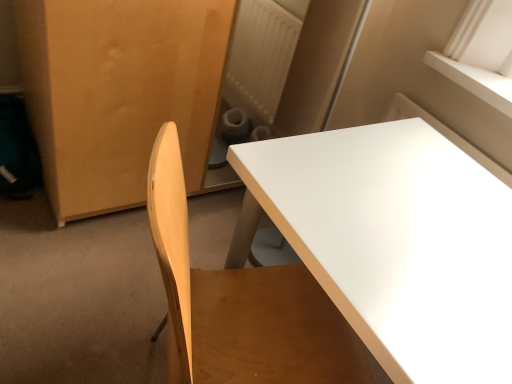
Question: Is matte wood armoire at left in front of or behind white glossy table at center in the image?

Choices:
 (A) front
 (B) behind

Answer: (B)

Question: Based on their sizes in the image, would you say matte wood armoire at left is bigger or smaller than white glossy table at center?

Choices:
 (A) big
 (B) small

Answer: (A)

Question: In the image, is matte wood armoire at left on the left side or the right side of white glossy table at center?

Choices:
 (A) left
 (B) right

Answer: (A)

Question: From the image's perspective, is white glossy table at center located above or below matte wood armoire at left?

Choices:
 (A) above
 (B) below

Answer: (B)

Question: In the image, is white glossy table at center positioned in front of or behind matte wood armoire at left?

Choices:
 (A) behind
 (B) front

Answer: (B)

Question: Is white glossy table at center wider or thinner than matte wood armoire at left?

Choices:
 (A) thin
 (B) wide

Answer: (A)

Question: Based on their sizes in the image, would you say white glossy table at center is bigger or smaller than matte wood armoire at left?

Choices:
 (A) big
 (B) small

Answer: (B)